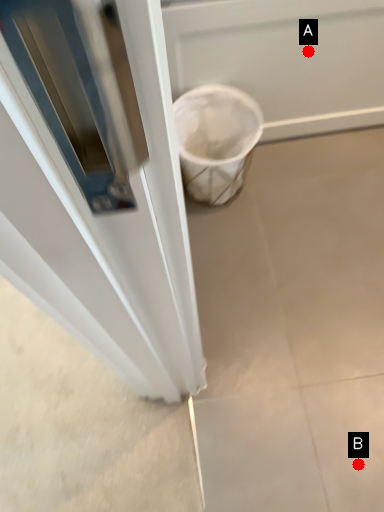
Question: Two points are circled on the image, labeled by A and B beside each circle. Which of the following is the farthest from the observer?

Choices:
 (A) A is further
 (B) B is further

Answer: (A)